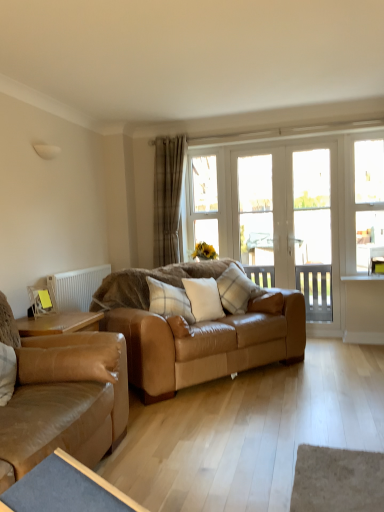
What are the coordinates of `clear glass window at right, arranged as the first window when viewed from the right` in the screenshot? It's located at (368, 201).

Measure the distance between clear glass window at right, the 3th window viewed from the left, and camera.

clear glass window at right, the 3th window viewed from the left, and camera are 4.11 meters apart from each other.

Describe the element at coordinates (63, 396) in the screenshot. I see `leather couch at left, marked as the 2th studio couch in a back-to-front arrangement` at that location.

The image size is (384, 512). Find the location of `blue fabric table at lower left`. blue fabric table at lower left is located at coordinates (65, 489).

The height and width of the screenshot is (512, 384). What do you see at coordinates (169, 300) in the screenshot?
I see `white plaid pillow at center, which is the first pillow from left to right` at bounding box center [169, 300].

What is the approximate width of white glass screen door at center, which appears as the second screen door when viewed from the right?

10.75 centimeters.

Where is `beige plaid curtain at center`? The image size is (384, 512). beige plaid curtain at center is located at coordinates (168, 199).

Is plaid fabric pillow at center, marked as the 3th pillow in a left-to-right arrangement, further to the viewer compared to leather couch at left, arranged as the 1th studio couch when viewed from the front?

Yes, it is behind leather couch at left, arranged as the 1th studio couch when viewed from the front.

Is plaid fabric pillow at center, marked as the 3th pillow in a left-to-right arrangement, to the left of leather couch at left, marked as the 2th studio couch in a back-to-front arrangement, from the viewer's perspective?

No.

How many degrees apart are the facing directions of plaid fabric pillow at center, marked as the 3th pillow in a left-to-right arrangement, and leather couch at left, marked as the 2th studio couch in a back-to-front arrangement?

The angular difference between plaid fabric pillow at center, marked as the 3th pillow in a left-to-right arrangement, and leather couch at left, marked as the 2th studio couch in a back-to-front arrangement, is 37.3 degrees.

Choose the correct answer: Is leather couch at center, which is the first studio couch in back-to-front order, inside blue fabric table at lower left or outside it?

leather couch at center, which is the first studio couch in back-to-front order, is not enclosed by blue fabric table at lower left.

Which object is wider, leather couch at center, which is the first studio couch in back-to-front order, or blue fabric table at lower left?

With larger width is leather couch at center, which is the first studio couch in back-to-front order.

From the image's perspective, is leather couch at center, which appears as the second studio couch when viewed from the front, located above or below blue fabric table at lower left?

leather couch at center, which appears as the second studio couch when viewed from the front, is situated higher than blue fabric table at lower left in the image.

Is leather couch at center, which is the first studio couch in back-to-front order, further to the viewer compared to blue fabric table at lower left?

Yes, the depth of leather couch at center, which is the first studio couch in back-to-front order, is greater than that of blue fabric table at lower left.

How distant is beige plaid curtain at center from white soft cushion at center, acting as the second pillow starting from the left?

beige plaid curtain at center and white soft cushion at center, acting as the second pillow starting from the left, are 3.86 feet apart.

Which is more to the left, beige plaid curtain at center or white soft cushion at center, acting as the second pillow starting from the left?

beige plaid curtain at center.

From the image's perspective, which one is positioned higher, beige plaid curtain at center or white soft cushion at center, the second pillow positioned from the right?

beige plaid curtain at center appears higher in the image.

How many degrees apart are the facing directions of beige plaid curtain at center and white soft cushion at center, acting as the second pillow starting from the left?

51.1 degrees separate the facing orientations of beige plaid curtain at center and white soft cushion at center, acting as the second pillow starting from the left.

Consider the image. From the image's perspective, is leather couch at center, which is the first studio couch in back-to-front order, under leather couch at left, marked as the 2th studio couch in a back-to-front arrangement?

No.

Is leather couch at center, which appears as the second studio couch when viewed from the front, in front of or behind leather couch at left, arranged as the 1th studio couch when viewed from the front, in the image?

In the image, leather couch at center, which appears as the second studio couch when viewed from the front, appears behind leather couch at left, arranged as the 1th studio couch when viewed from the front.

Looking at this image, do you think leather couch at center, which is the first studio couch in back-to-front order, is within leather couch at left, arranged as the 1th studio couch when viewed from the front, or outside of it?

leather couch at center, which is the first studio couch in back-to-front order, is spatially situated outside leather couch at left, arranged as the 1th studio couch when viewed from the front.

Which of these two, leather couch at center, which is the first studio couch in back-to-front order, or leather couch at left, arranged as the 1th studio couch when viewed from the front, is wider?

leather couch at left, arranged as the 1th studio couch when viewed from the front.

In terms of height, does clear glass door at center, the second window viewed from the right, look taller or shorter compared to white plastic radiator at left?

clear glass door at center, the second window viewed from the right, is taller than white plastic radiator at left.

Does clear glass door at center, which appears as the second window when viewed from the left, lie behind white plastic radiator at left?

That is True.

How different are the orientations of clear glass door at center, the second window viewed from the right, and white plastic radiator at left in degrees?

The angle between the facing direction of clear glass door at center, the second window viewed from the right, and the facing direction of white plastic radiator at left is 90.1 degrees.

From the image's perspective, is clear glass door at center, which appears as the second window when viewed from the left, above or below white plastic radiator at left?

clear glass door at center, which appears as the second window when viewed from the left, is above white plastic radiator at left.

Are clear glass window at right, the 3th window viewed from the left, and clear glass window at center, which ranks as the first window in left-to-right order, located far from each other?

Yes, clear glass window at right, the 3th window viewed from the left, is far from clear glass window at center, which ranks as the first window in left-to-right order.

From a real-world perspective, is clear glass window at right, arranged as the first window when viewed from the right, physically located above or below clear glass window at center, which is the third window from right to left?

In terms of real-world spatial position, clear glass window at right, arranged as the first window when viewed from the right, is below clear glass window at center, which is the third window from right to left.

From the image's perspective, is clear glass window at right, arranged as the first window when viewed from the right, located beneath clear glass window at center, which ranks as the first window in left-to-right order?

Yes.

Based on the photo, which is correct: clear glass window at right, arranged as the first window when viewed from the right, is inside clear glass window at center, which ranks as the first window in left-to-right order, or outside of it?

clear glass window at right, arranged as the first window when viewed from the right, cannot be found inside clear glass window at center, which ranks as the first window in left-to-right order.

Which point is more distant from viewer, (318, 277) or (271, 164)?

The point (318, 277) is more distant.

Does clear glass screen door at right, acting as the second screen door starting from the left, have a lesser height compared to clear glass door at center, the second window viewed from the right?

No, clear glass screen door at right, acting as the second screen door starting from the left, is not shorter than clear glass door at center, the second window viewed from the right.

Is clear glass door at center, which appears as the second window when viewed from the left, located within clear glass screen door at right, which is the first screen door from right to left?

No, clear glass door at center, which appears as the second window when viewed from the left, is not inside clear glass screen door at right, which is the first screen door from right to left.

Is clear glass screen door at right, which is the first screen door from right to left, touching clear glass door at center, which appears as the second window when viewed from the left?

There is a gap between clear glass screen door at right, which is the first screen door from right to left, and clear glass door at center, which appears as the second window when viewed from the left.

Identify the location of pillow that is the 3rd object above the leather couch at left, marked as the 2th studio couch in a back-to-front arrangement (from a real-world perspective). (237, 290).

Where is `the 2nd studio couch behind the blue fabric table at lower left, starting your count from the anchor`? Image resolution: width=384 pixels, height=512 pixels. the 2nd studio couch behind the blue fabric table at lower left, starting your count from the anchor is located at coordinates (195, 332).

From the image, which object appears to be farther from white plaid pillow at center, which is the first pillow from left to right, clear glass screen door at right, which is the first screen door from right to left, or white soft cushion at center, the second pillow positioned from the right?

clear glass screen door at right, which is the first screen door from right to left, is positioned further to the anchor white plaid pillow at center, which is the first pillow from left to right.

From the picture: Estimate the real-world distances between objects in this image. Which object is closer to white glass screen door at center, which appears as the second screen door when viewed from the right, white soft cushion at center, acting as the second pillow starting from the left, or clear glass screen door at right, which is the first screen door from right to left?

clear glass screen door at right, which is the first screen door from right to left, lies closer to white glass screen door at center, which appears as the second screen door when viewed from the right, than the other object.

Based on their spatial positions, is beige plaid curtain at center or leather couch at center, which appears as the second studio couch when viewed from the front, further from white plastic radiator at left?

leather couch at center, which appears as the second studio couch when viewed from the front, is positioned further to the anchor white plastic radiator at left.

Looking at the image, which one is located further to plaid fabric pillow at center, positioned as the 1th pillow in right-to-left order, white plaid pillow at center, the third pillow viewed from the right, or clear glass screen door at right, which is the first screen door from right to left?

clear glass screen door at right, which is the first screen door from right to left, is further to plaid fabric pillow at center, positioned as the 1th pillow in right-to-left order.

Considering their positions, is clear glass screen door at right, which is the first screen door from right to left, positioned closer to leather couch at center, which appears as the second studio couch when viewed from the front, than beige plaid curtain at center?

clear glass screen door at right, which is the first screen door from right to left, is positioned closer to the anchor leather couch at center, which appears as the second studio couch when viewed from the front.

Based on their spatial positions, is white plaid pillow at center, the third pillow viewed from the right, or clear glass window at center, which is the third window from right to left, closer to plaid fabric pillow at center, marked as the 3th pillow in a left-to-right arrangement?

Among the two, white plaid pillow at center, the third pillow viewed from the right, is located nearer to plaid fabric pillow at center, marked as the 3th pillow in a left-to-right arrangement.

Which object lies nearer to the anchor point white plastic radiator at left, clear glass window at center, which ranks as the first window in left-to-right order, or clear glass door at center, which appears as the second window when viewed from the left?

clear glass window at center, which ranks as the first window in left-to-right order.

Looking at the image, which one is located further to leather couch at left, marked as the 2th studio couch in a back-to-front arrangement, beige plaid curtain at center or clear glass window at right, the 3th window viewed from the left?

The object further to leather couch at left, marked as the 2th studio couch in a back-to-front arrangement, is clear glass window at right, the 3th window viewed from the left.

Locate an element on the screen. Image resolution: width=384 pixels, height=512 pixels. studio couch between leather couch at left, marked as the 2th studio couch in a back-to-front arrangement, and clear glass window at right, the 3th window viewed from the left, in the front-back direction is located at coordinates (195, 332).

The image size is (384, 512). Identify the location of curtain located between leather couch at left, marked as the 2th studio couch in a back-to-front arrangement, and clear glass window at center, which ranks as the first window in left-to-right order, in the depth direction. (168, 199).

At what (x,y) coordinates should I click in order to perform the action: click on pillow between white soft cushion at center, the second pillow positioned from the right, and clear glass door at center, the second window viewed from the right, from front to back. Please return your answer as a coordinate pair (x, y). Image resolution: width=384 pixels, height=512 pixels. Looking at the image, I should click on (237, 290).

At what (x,y) coordinates should I click in order to perform the action: click on screen door positioned between leather couch at left, marked as the 2th studio couch in a back-to-front arrangement, and white glass screen door at center, which ranks as the 1th screen door in left-to-right order, from near to far. Please return your answer as a coordinate pair (x, y). The width and height of the screenshot is (384, 512). Looking at the image, I should click on (313, 232).